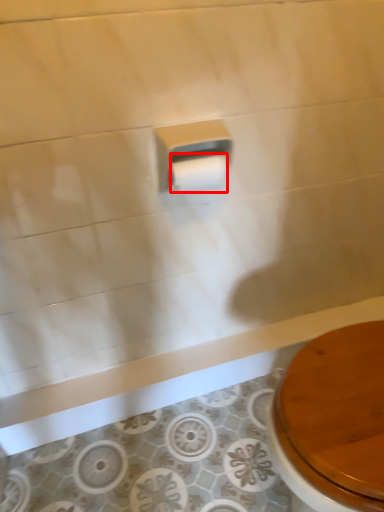
Question: From the image's perspective, what is the correct spatial positioning of toilet paper (annotated by the red box) in reference to toilet paper?

Choices:
 (A) below
 (B) above

Answer: (A)